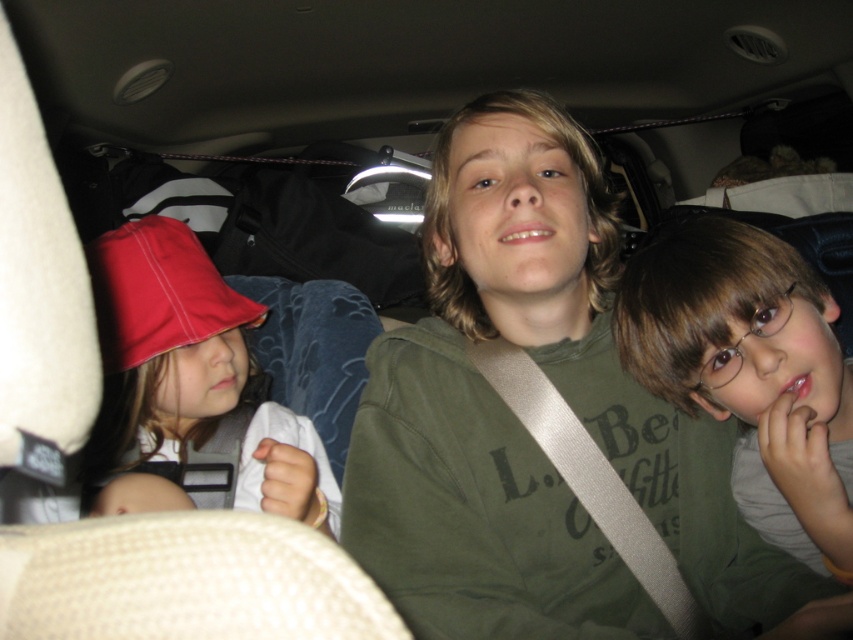
Question: Can you confirm if matte green shirt at center is wider than matte red hat at left?

Choices:
 (A) yes
 (B) no

Answer: (B)

Question: Is the position of matte green shirt at center more distant than that of matte red hat at left?

Choices:
 (A) no
 (B) yes

Answer: (A)

Question: Among these points, which one is nearest to the camera?

Choices:
 (A) (827, 429)
 (B) (254, 506)

Answer: (A)

Question: Can you confirm if matte green shirt at center is wider than matte red hat at left?

Choices:
 (A) yes
 (B) no

Answer: (B)

Question: Among these points, which one is nearest to the camera?

Choices:
 (A) (761, 499)
 (B) (332, 515)

Answer: (A)

Question: Which point appears farthest from the camera in this image?

Choices:
 (A) (735, 291)
 (B) (322, 509)

Answer: (B)